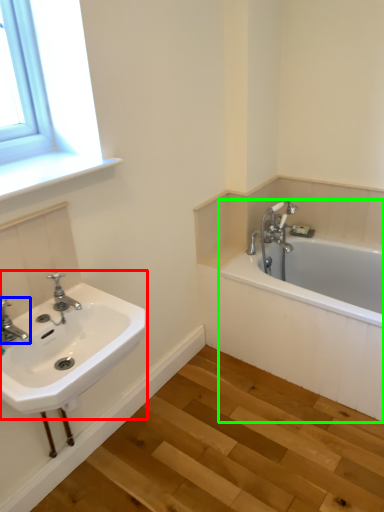
Question: Based on their relative distances, which object is nearer to sink (highlighted by a red box)? Choose from tap (highlighted by a blue box) and bathtub (highlighted by a green box).

Choices:
 (A) tap
 (B) bathtub

Answer: (A)